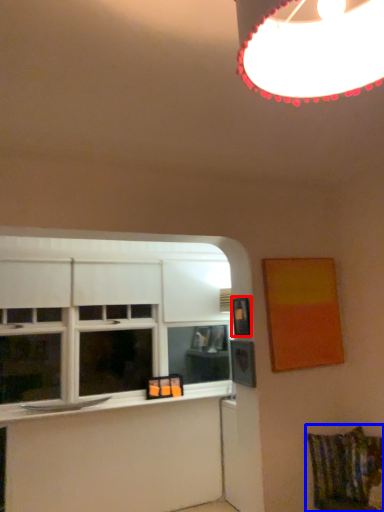
Question: Which object is further to the camera taking this photo, picture frame (highlighted by a red box) or swivel chair (highlighted by a blue box)?

Choices:
 (A) picture frame
 (B) swivel chair

Answer: (A)